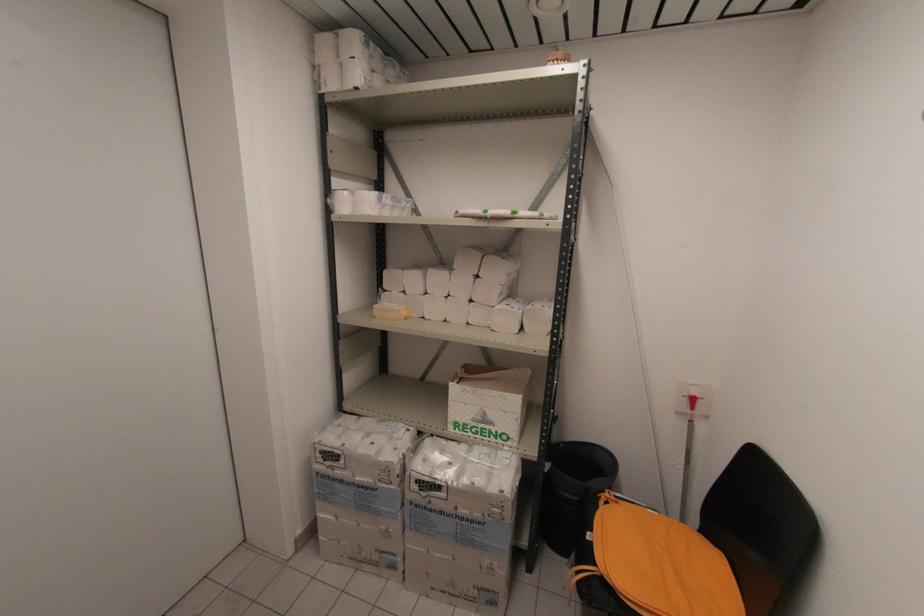
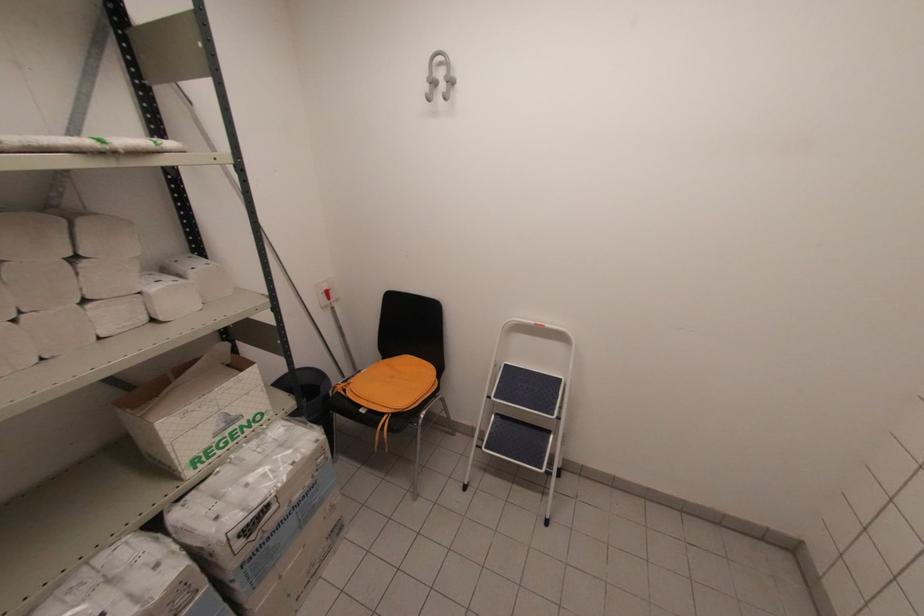
Find the pixel in the second image that matches pixel 484 215 in the first image.

(107, 148)